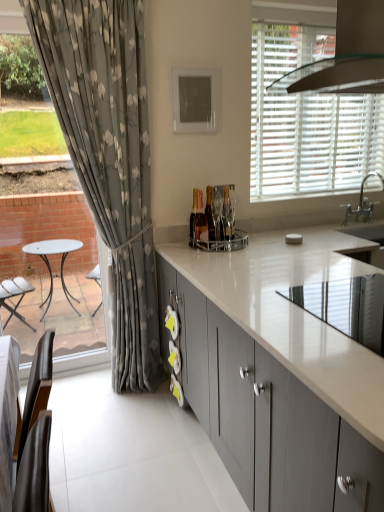
Locate an element on the screen. The width and height of the screenshot is (384, 512). vacant space to the left of fluffy gray curtain at left is located at coordinates (77, 392).